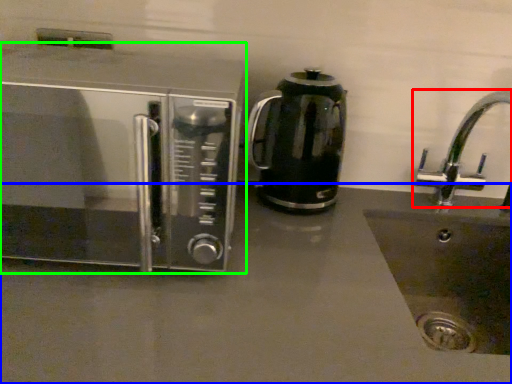
Question: Based on their relative distances, which object is farther from tap (highlighted by a red box)? Choose from counter top (highlighted by a blue box) and microwave oven (highlighted by a green box).

Choices:
 (A) counter top
 (B) microwave oven

Answer: (B)